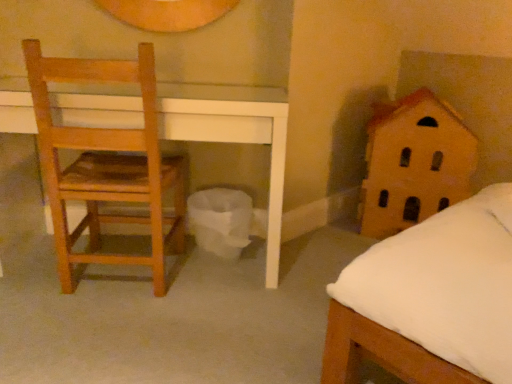
You are a GUI agent. You are given a task and a screenshot of the screen. Output one action in this format:
    pyautogui.click(x=<x>, y=<y>)
    Task: Click on the vacant area located to the right-hand side of wooden chair at left
    
    Given the screenshot: What is the action you would take?
    pyautogui.click(x=217, y=301)